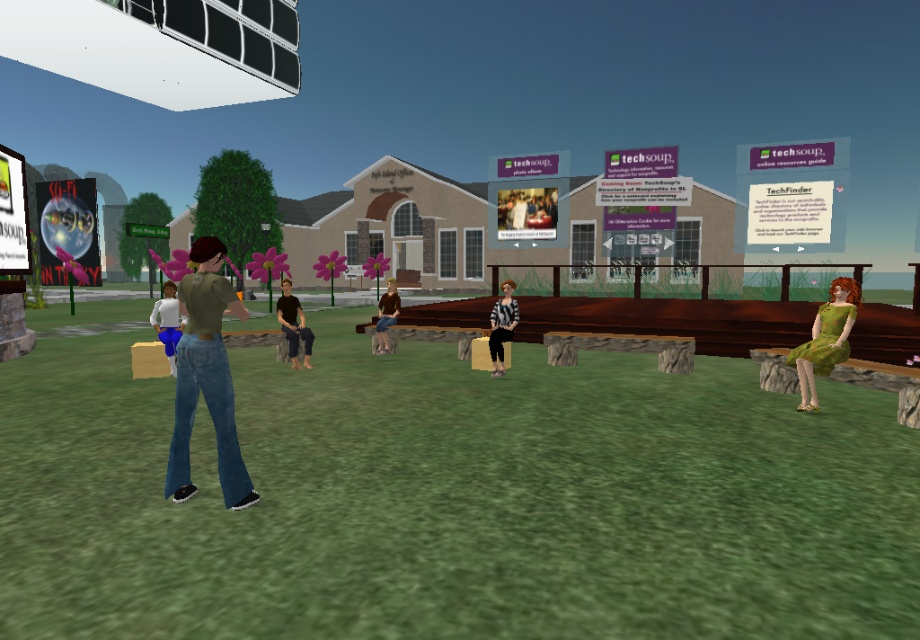
Question: Can you confirm if dark brown leather pants at center is positioned above striped jersey at center?

Choices:
 (A) no
 (B) yes

Answer: (B)

Question: Can you confirm if denim jeans at center is positioned below green fabric dress at lower right?

Choices:
 (A) no
 (B) yes

Answer: (B)

Question: Among these objects, which one is farthest from the camera?

Choices:
 (A) white matte shirt at center
 (B) green fabric dress at lower right

Answer: (A)

Question: Can you confirm if denim jeans at center is thinner than dark brown leather pants at center?

Choices:
 (A) yes
 (B) no

Answer: (B)

Question: Among these points, which one is nearest to the camera?

Choices:
 (A) (386, 339)
 (B) (187, 401)
 (C) (171, 284)
 (D) (496, 316)

Answer: (B)

Question: Which point is farther from the camera taking this photo?

Choices:
 (A) (499, 353)
 (B) (190, 384)

Answer: (A)